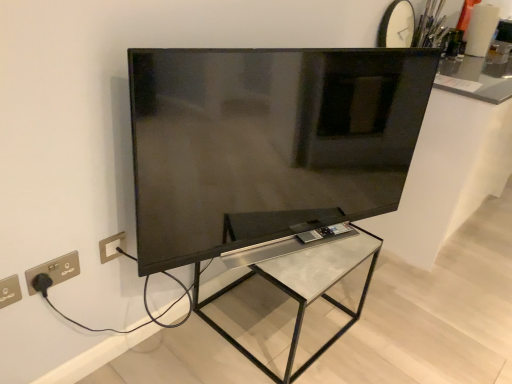
Question: From a real-world perspective, is white glossy countertop at upper right over metallic glass table at center?

Choices:
 (A) no
 (B) yes

Answer: (B)

Question: Is the position of white glossy countertop at upper right less distant than that of metallic glass table at center?

Choices:
 (A) no
 (B) yes

Answer: (A)

Question: Is metallic glass table at center inside white glossy countertop at upper right?

Choices:
 (A) yes
 (B) no

Answer: (B)

Question: Can you confirm if white glossy countertop at upper right is shorter than metallic glass table at center?

Choices:
 (A) yes
 (B) no

Answer: (B)

Question: Does white glossy countertop at upper right have a greater height compared to metallic glass table at center?

Choices:
 (A) yes
 (B) no

Answer: (A)

Question: Visually, is metallic glass table at center positioned to the left or to the right of silver metallic electric outlet at lower left?

Choices:
 (A) right
 (B) left

Answer: (A)

Question: Considering the positions of metallic glass table at center and silver metallic electric outlet at lower left in the image, is metallic glass table at center bigger or smaller than silver metallic electric outlet at lower left?

Choices:
 (A) small
 (B) big

Answer: (B)

Question: Does point coord(308,289) appear closer or farther from the camera than point coord(3,291)?

Choices:
 (A) farther
 (B) closer

Answer: (A)

Question: From a real-world perspective, is metallic glass table at center above or below silver metallic electric outlet at lower left?

Choices:
 (A) above
 (B) below

Answer: (B)

Question: In terms of size, does white glossy countertop at upper right appear bigger or smaller than gold metallic socket at lower left?

Choices:
 (A) small
 (B) big

Answer: (B)

Question: Is white glossy countertop at upper right in front of or behind gold metallic socket at lower left in the image?

Choices:
 (A) front
 (B) behind

Answer: (B)

Question: Do you think white glossy countertop at upper right is within gold metallic socket at lower left, or outside of it?

Choices:
 (A) inside
 (B) outside

Answer: (B)

Question: In terms of height, does white glossy countertop at upper right look taller or shorter compared to gold metallic socket at lower left?

Choices:
 (A) short
 (B) tall

Answer: (B)

Question: Does point (2, 296) appear closer or farther from the camera than point (435, 64)?

Choices:
 (A) farther
 (B) closer

Answer: (B)

Question: From a real-world perspective, is silver metallic electric outlet at lower left physically located above or below matte black tv at center?

Choices:
 (A) above
 (B) below

Answer: (B)